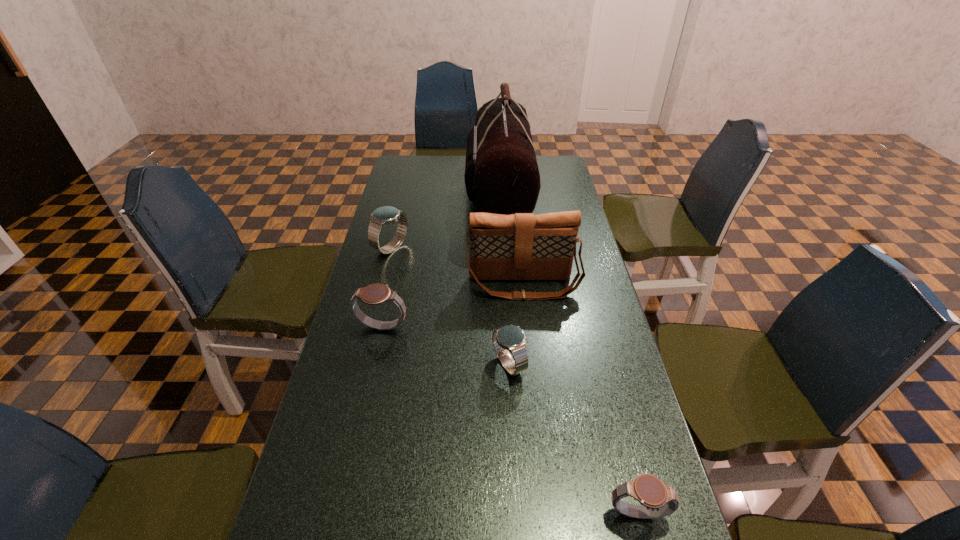
The width and height of the screenshot is (960, 540). Find the location of `the right gray watch`. the right gray watch is located at coordinates (657, 499).

Locate an element on the screen. The height and width of the screenshot is (540, 960). the smaller gray watch is located at coordinates (657, 499).

Identify the location of vacant space located 0.090m on the front pocket of the tallest object. This screenshot has width=960, height=540. (443, 190).

Identify the location of free region located on the front pocket of the tallest object. (443, 190).

Identify the location of free region located 0.150m on the front pocket of the tallest object. (428, 190).

At what (x,y) coordinates should I click in order to perform the action: click on free location located 0.230m on the front-facing side of the second tallest object. Please return your answer as a coordinate pair (x, y). Image resolution: width=960 pixels, height=540 pixels. Looking at the image, I should click on (532, 363).

You are a GUI agent. You are given a task and a screenshot of the screen. Output one action in this format:
    pyautogui.click(x=<x>, y=<y>)
    Task: Click on the blank space located on the back of the biggest blue watch
    Image resolution: width=960 pixels, height=540 pixels.
    Given the screenshot: What is the action you would take?
    pyautogui.click(x=401, y=209)

At what (x,y) coordinates should I click in order to perform the action: click on vacant space located 0.190m on the front of the left gray watch. Please return your answer as a coordinate pair (x, y). The width and height of the screenshot is (960, 540). Looking at the image, I should click on (367, 398).

Where is `blank space located 0.240m on the right of the second farthest blue watch`? blank space located 0.240m on the right of the second farthest blue watch is located at coordinates point(619,364).

This screenshot has width=960, height=540. In order to click on vacant area situated 0.280m on the left of the nearer gray watch in this screenshot , I will do `click(463, 515)`.